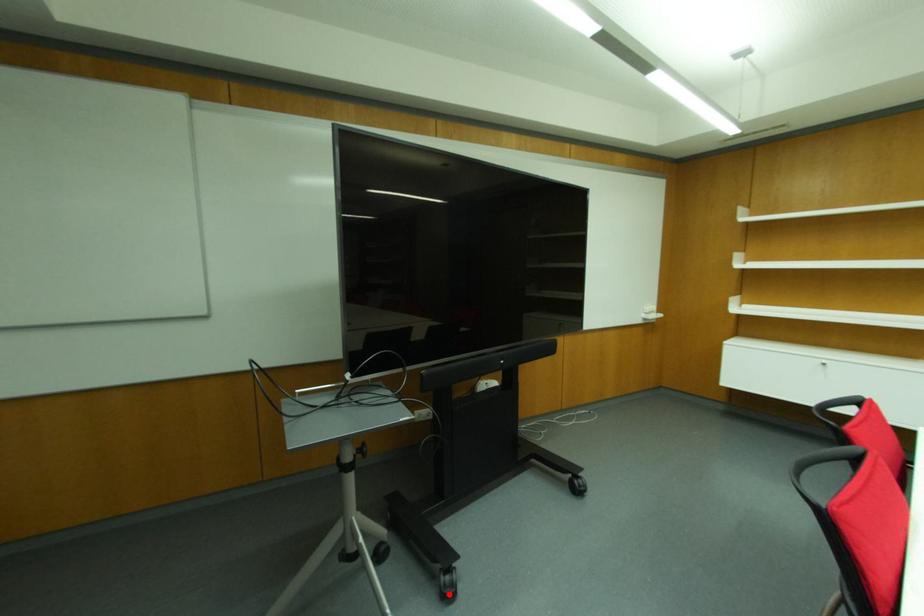
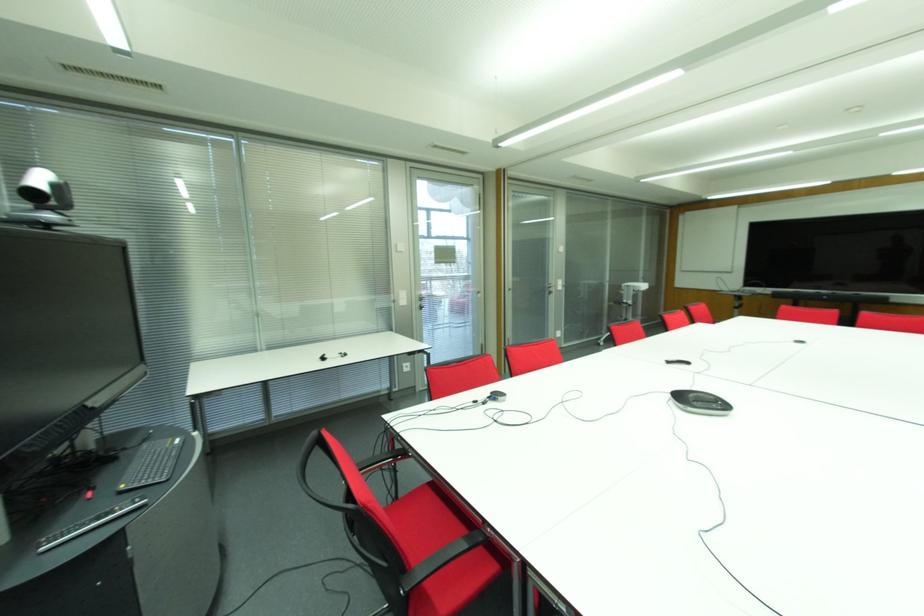
Question: I am providing you with two images of the same scene from different viewpoints. A red point is marked on the first image. At the location where the point appears in image 1, is it still visible in image 2?

Choices:
 (A) Yes
 (B) No

Answer: (B)